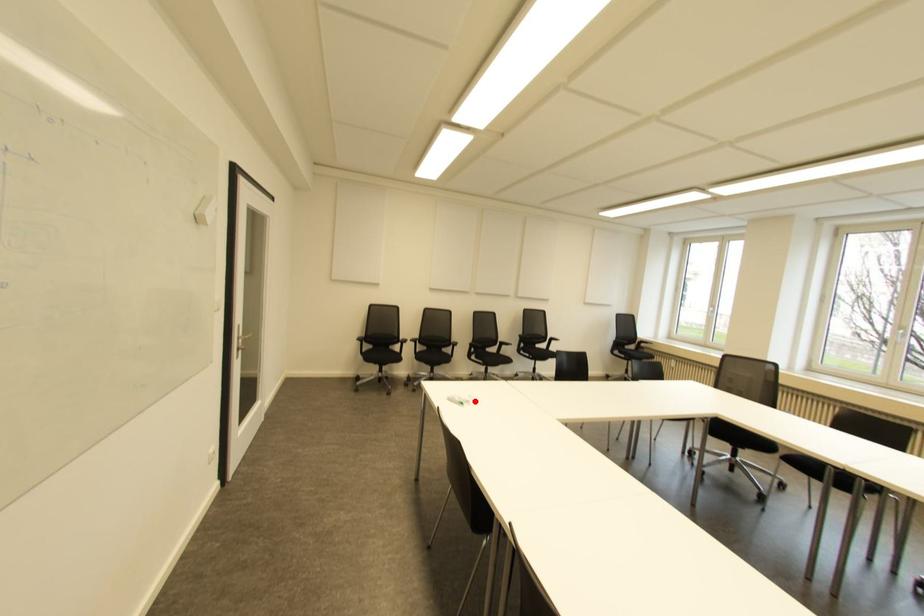
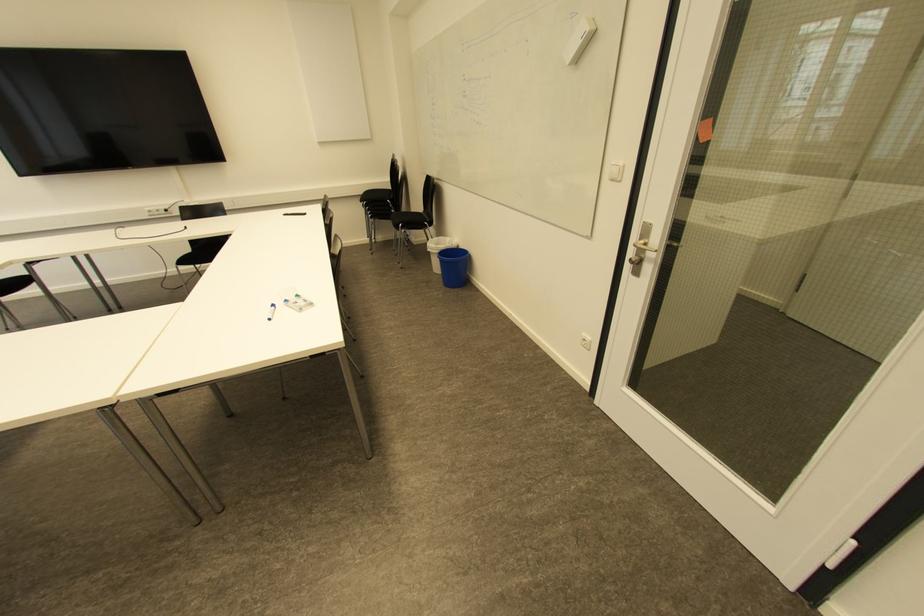
Where in the second image is the point corresponding to the highlighted location from the first image?

(273, 306)